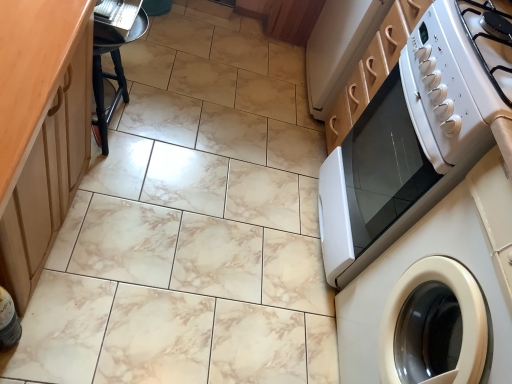
Measure the distance between wooden at left and camera.

wooden at left is 55.26 centimeters from camera.

Image resolution: width=512 pixels, height=384 pixels. Identify the location of black wood bar stool at left. (112, 57).

Locate an element on the screen. The width and height of the screenshot is (512, 384). white glossy microwave at right is located at coordinates (417, 133).

This screenshot has height=384, width=512. What do you see at coordinates (456, 88) in the screenshot?
I see `white glossy gas stove at upper right` at bounding box center [456, 88].

The image size is (512, 384). Find the location of `wooden at left`. wooden at left is located at coordinates (41, 130).

Which is in front, point (448, 102) or point (378, 359)?

Point (448, 102)

Between white glossy gas stove at upper right and white glossy washing machine at right, which one has larger size?

Bigger between the two is white glossy washing machine at right.

Would you say wooden at left is inside or outside white glossy microwave at right?

wooden at left cannot be found inside white glossy microwave at right.

How different are the orientations of wooden at left and white glossy microwave at right in degrees?

The angular difference between wooden at left and white glossy microwave at right is 180 degrees.

Identify the location of counter top in front of the white glossy microwave at right. This screenshot has width=512, height=384. (41, 130).

Does wooden at left have a larger size compared to white glossy microwave at right?

Yes.

Is white glossy washing machine at right positioned before white glossy gas stove at upper right?

Yes.

Between white glossy washing machine at right and white glossy gas stove at upper right, which one has larger size?

With larger size is white glossy washing machine at right.

From a real-world perspective, is white glossy washing machine at right over white glossy gas stove at upper right?

No, from a real-world perspective, white glossy washing machine at right is not on top of white glossy gas stove at upper right.

Is white glossy microwave at right located within black wood bar stool at left?

That's incorrect, white glossy microwave at right is not inside black wood bar stool at left.

From a real-world perspective, who is located higher, black wood bar stool at left or white glossy microwave at right?

white glossy microwave at right.

Considering the points (135, 13) and (410, 220), which point is behind, point (135, 13) or point (410, 220)?

Positioned behind is point (135, 13).

Which object is thinner, black wood bar stool at left or white glossy microwave at right?

With smaller width is black wood bar stool at left.

From the image's perspective, which object appears higher, white glossy microwave at right or black wood bar stool at left?

black wood bar stool at left, from the image's perspective.

How different are the orientations of white glossy microwave at right and black wood bar stool at left in degrees?

The angular difference between white glossy microwave at right and black wood bar stool at left is 176 degrees.

Considering the relative positions of white glossy microwave at right and black wood bar stool at left in the image provided, is white glossy microwave at right to the right of black wood bar stool at left from the viewer's perspective?

Yes, white glossy microwave at right is to the right of black wood bar stool at left.

Who is taller, wooden at left or white glossy gas stove at upper right?

wooden at left.

Measure the distance between wooden at left and white glossy gas stove at upper right.

The distance of wooden at left from white glossy gas stove at upper right is 34.53 inches.

Which object is thinner, wooden at left or white glossy gas stove at upper right?

Thinner between the two is wooden at left.

Where is `gas stove that appears above the wooden at left (from the image's perspective)`? This screenshot has height=384, width=512. gas stove that appears above the wooden at left (from the image's perspective) is located at coordinates (456, 88).

Considering the positions of objects white glossy gas stove at upper right and wooden at left in the image provided, who is more to the right, white glossy gas stove at upper right or wooden at left?

Positioned to the right is white glossy gas stove at upper right.

Who is bigger, white glossy gas stove at upper right or wooden at left?

wooden at left is bigger.

Is white glossy gas stove at upper right next to wooden at left?

No, white glossy gas stove at upper right is not with wooden at left.

The image size is (512, 384). In order to click on washing machine located on the left of white glossy gas stove at upper right in this screenshot , I will do `click(439, 255)`.

You are a GUI agent. You are given a task and a screenshot of the screen. Output one action in this format:
    pyautogui.click(x=<x>, y=<y>)
    Task: Click on the counter top above the white glossy microwave at right (from a real-world perspective)
    The height and width of the screenshot is (384, 512).
    Given the screenshot: What is the action you would take?
    pyautogui.click(x=41, y=130)

Based on their spatial positions, is wooden at left or white glossy gas stove at upper right further from white glossy microwave at right?

Based on the image, wooden at left appears to be further to white glossy microwave at right.

Looking at this image, when comparing their distances from wooden at left, does white glossy washing machine at right or black wood bar stool at left seem closer?

Based on the image, black wood bar stool at left appears to be nearer to wooden at left.

From the image, which object appears to be farther from black wood bar stool at left, wooden at left or white glossy washing machine at right?

white glossy washing machine at right.

From the image, which object appears to be farther from white glossy washing machine at right, white glossy microwave at right or white glossy gas stove at upper right?

white glossy gas stove at upper right is positioned further to the anchor white glossy washing machine at right.

From the image, which object appears to be farther from white glossy microwave at right, wooden at left or black wood bar stool at left?

Based on the image, black wood bar stool at left appears to be further to white glossy microwave at right.

Based on the photo, when comparing their distances from wooden at left, does white glossy washing machine at right or white glossy microwave at right seem further?

The object further to wooden at left is white glossy washing machine at right.

Looking at the image, which one is located closer to wooden at left, white glossy gas stove at upper right or white glossy microwave at right?

white glossy gas stove at upper right is closer to wooden at left.

Looking at the image, which one is located closer to white glossy microwave at right, wooden at left or white glossy washing machine at right?

white glossy washing machine at right lies closer to white glossy microwave at right than the other object.

This screenshot has width=512, height=384. I want to click on home appliance between white glossy gas stove at upper right and white glossy washing machine at right in the vertical direction, so click(417, 133).

Where is `home appliance situated between black wood bar stool at left and white glossy gas stove at upper right from left to right`? The width and height of the screenshot is (512, 384). home appliance situated between black wood bar stool at left and white glossy gas stove at upper right from left to right is located at coordinates point(417,133).

You are a GUI agent. You are given a task and a screenshot of the screen. Output one action in this format:
    pyautogui.click(x=<x>, y=<y>)
    Task: Click on the bar stool between wooden at left and white glossy gas stove at upper right
    This screenshot has height=384, width=512.
    Given the screenshot: What is the action you would take?
    pyautogui.click(x=112, y=57)

Where is `washing machine between wooden at left and white glossy gas stove at upper right from left to right`? washing machine between wooden at left and white glossy gas stove at upper right from left to right is located at coordinates (439, 255).